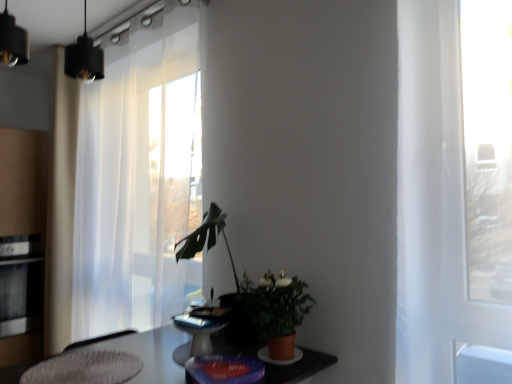
Question: Is point (39, 276) closer or farther from the camera than point (87, 380)?

Choices:
 (A) closer
 (B) farther

Answer: (B)

Question: Which is correct: stainless steel oven at left is inside textured gray rug at lower left, or outside of it?

Choices:
 (A) inside
 (B) outside

Answer: (B)

Question: Which of these objects is positioned closest to the matte terracotta pot at center?

Choices:
 (A) textured gray rug at lower left
 (B) stainless steel oven at left
 (C) white sheer curtain at left
 (D) green matte plant at center

Answer: (D)

Question: Estimate the real-world distances between objects in this image. Which object is farther from the stainless steel oven at left?

Choices:
 (A) white sheer curtain at left
 (B) textured gray rug at lower left
 (C) matte terracotta pot at center
 (D) green matte plant at center

Answer: (C)